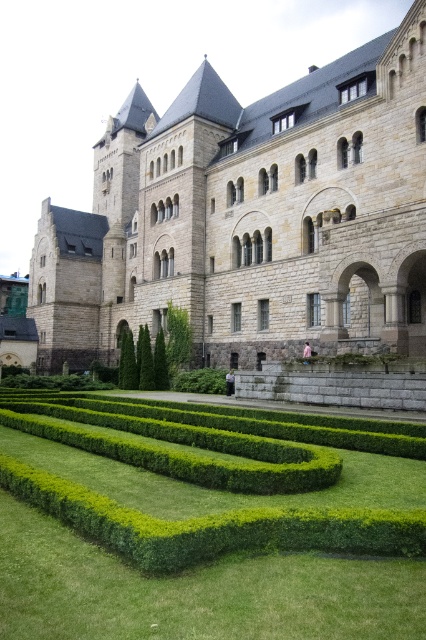
Question: Does green hedge at center have a lesser width compared to green leafy bush at lower center?

Choices:
 (A) no
 (B) yes

Answer: (A)

Question: Which point is farther to the camera?

Choices:
 (A) gray stone castle at center
 (B) green leafy bush at lower center

Answer: (B)

Question: Which of the following is the farthest from the observer?

Choices:
 (A) (221, 584)
 (B) (180, 342)

Answer: (B)

Question: Is gray stone castle at center to the left of green leafy bush at lower center from the viewer's perspective?

Choices:
 (A) no
 (B) yes

Answer: (B)

Question: Which object appears closest to the camera in this image?

Choices:
 (A) gray stone castle at center
 (B) green leafy bush at lower center

Answer: (A)

Question: Is gray stone castle at center to the left of green hedge at center from the viewer's perspective?

Choices:
 (A) no
 (B) yes

Answer: (B)